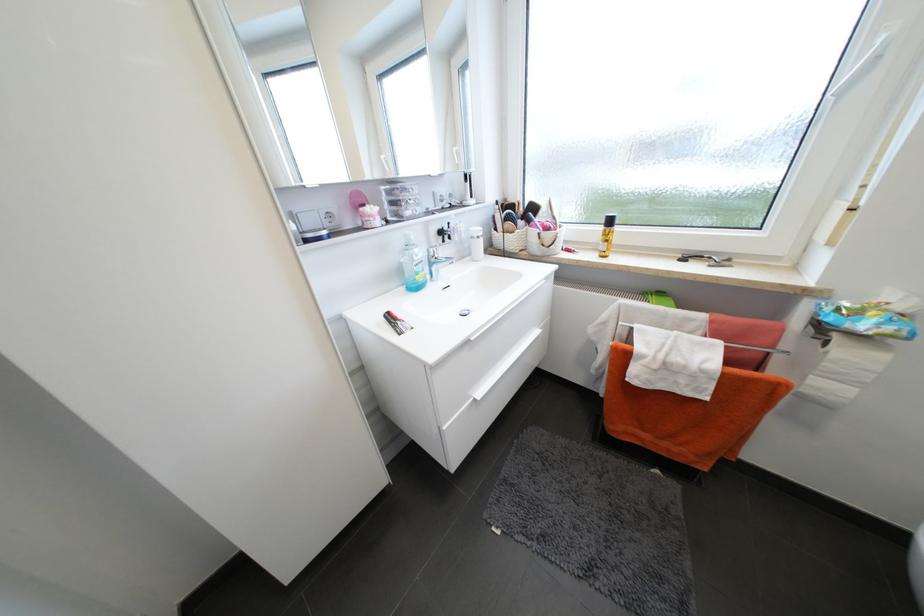
This screenshot has height=616, width=924. I want to click on soap dispenser pump, so click(476, 243).